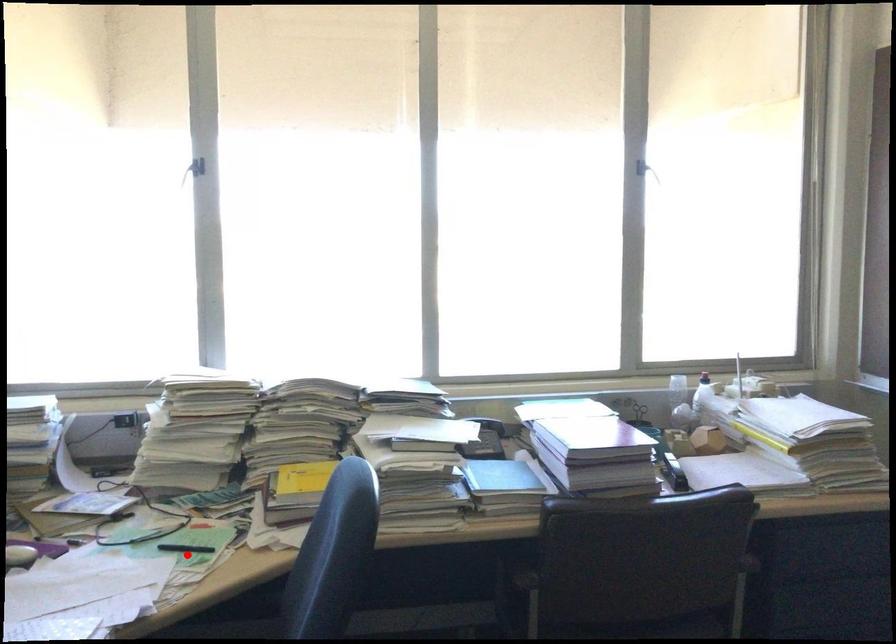
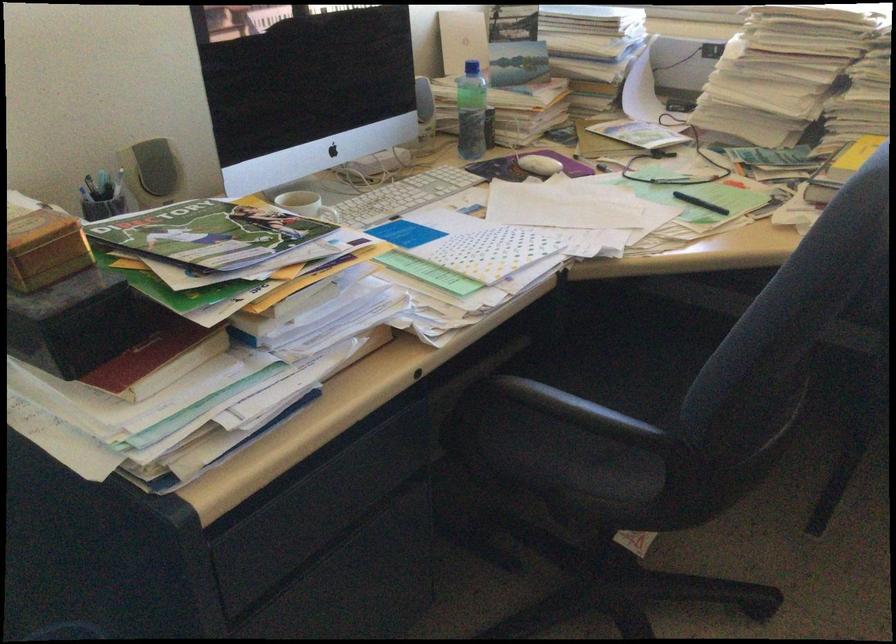
Find the pixel in the second image that matches the highlighted location in the first image.

(700, 203)